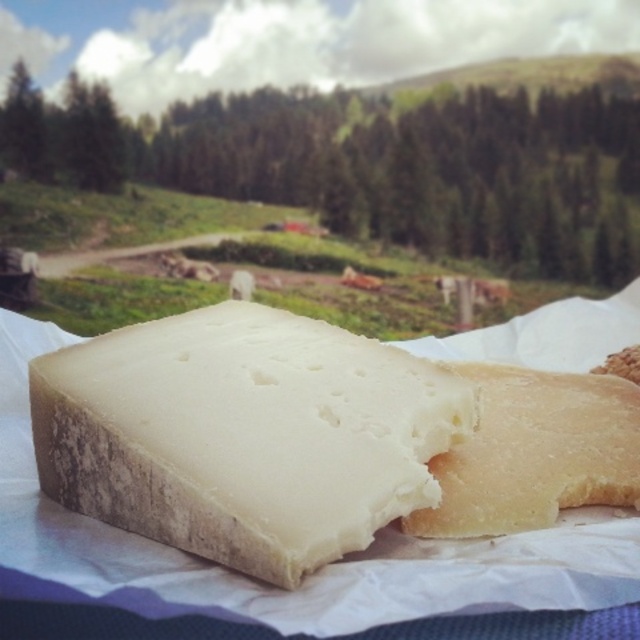
You are planning a picnic and have both the white crumbly cheese at center and the white crumbly bread at center in front of you. Which item takes up more space on the paper surface?

The white crumbly cheese at center is bigger than the white crumbly bread at center, so it takes up more space on the paper surface.

You are planning to pack a picnic basket and need to place a white crumbly cheese at center. The picnic basket has a lid that closes tightly. If you place the cheese exactly at point (244, 435), will it fit inside the basket without any part sticking out?

The white crumbly cheese at center is located at point (244, 435), so it will fit inside the basket as long as the basket is large enough to accommodate the cheese at that specific coordinate.

Consider the image. You are a photographer trying to capture the cheese block in the image. You notice two points marked on the cheese block at coordinates point (156, 444) and point (474, 442). Which point would appear larger in your photo if you focus on the cheese block?

Point (156, 444) would appear larger in the photo because it is closer to the camera than point (474, 442).